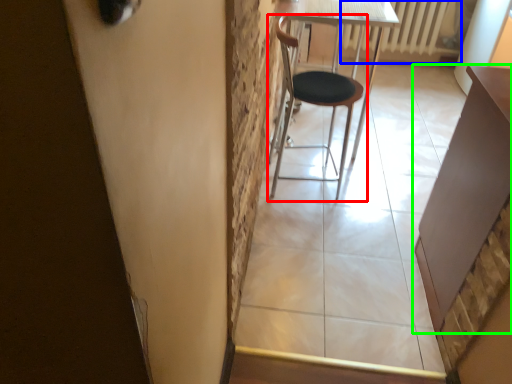
Question: Which is nearer to the chair (highlighted by a red box)? radiator (highlighted by a blue box) or table (highlighted by a green box).

Choices:
 (A) radiator
 (B) table

Answer: (B)